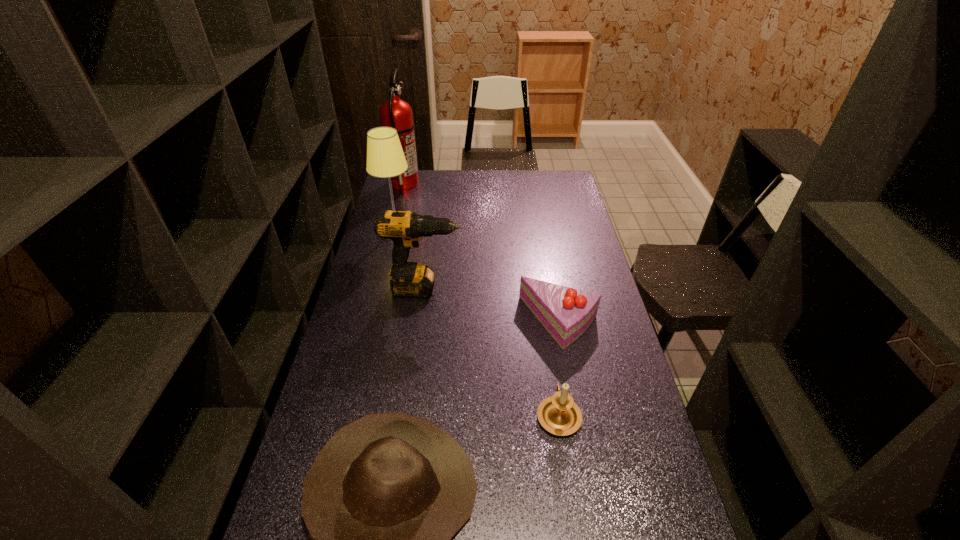
At what (x,y) coordinates should I click in order to perform the action: click on object that stands as the fourth closest to the fire extinguisher. Please return your answer as a coordinate pair (x, y). The width and height of the screenshot is (960, 540). Looking at the image, I should click on (559, 414).

You are a GUI agent. You are given a task and a screenshot of the screen. Output one action in this format:
    pyautogui.click(x=<x>, y=<y>)
    Task: Click on the third closest object to the cake
    
    Given the screenshot: What is the action you would take?
    (x=384, y=497)

Where is `vacant space that satisfies the following two spatial constraints: 1. with a handle on the side of the candle holder; 2. at the nozzle of the fire extinguisher`? The height and width of the screenshot is (540, 960). vacant space that satisfies the following two spatial constraints: 1. with a handle on the side of the candle holder; 2. at the nozzle of the fire extinguisher is located at coordinates (523, 183).

Locate an element on the screen. vacant point that satisfies the following two spatial constraints: 1. on the back side of the second farthest object; 2. at the nozzle of the tallest object is located at coordinates (408, 183).

Where is `free spot that satisfies the following two spatial constraints: 1. at the tip of the cake; 2. on the right side of the fourth shortest object`? Image resolution: width=960 pixels, height=540 pixels. free spot that satisfies the following two spatial constraints: 1. at the tip of the cake; 2. on the right side of the fourth shortest object is located at coordinates [420, 322].

Find the location of a particular element. free spot that satisfies the following two spatial constraints: 1. at the tip of the third tallest object; 2. with a handle on the side of the candle holder is located at coordinates (407, 415).